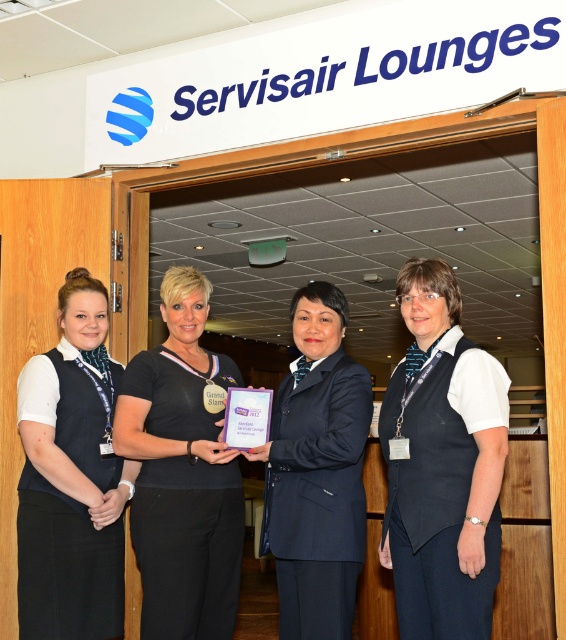
Looking at this image, you are a guest at the Servisair Lounge and need to locate the staff member wearing the white fabric vest at center. Which direction should you look relative to the matte black vest at left?

You should look to the right of the matte black vest at left to find the white fabric vest at center.

You are standing 5 feet away from the wooden door. If you want to hand a document to the person wearing the white fabric vest at center, will you be able to reach them without moving closer?

The white fabric vest at center is 6.60 feet away from the viewer. Since you are standing 5 feet away from the wooden door, you are 1 foot away from the white fabric vest at center. Therefore, you can reach them without moving closer.